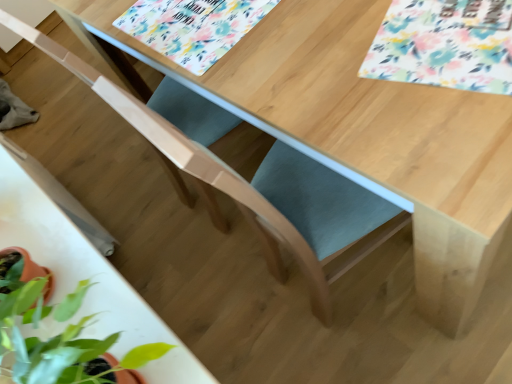
Find the location of a particular element. The height and width of the screenshot is (384, 512). free region under floral-patterned paper at upper right, the 2th flower from the back (from a real-world perspective) is located at coordinates (465, 29).